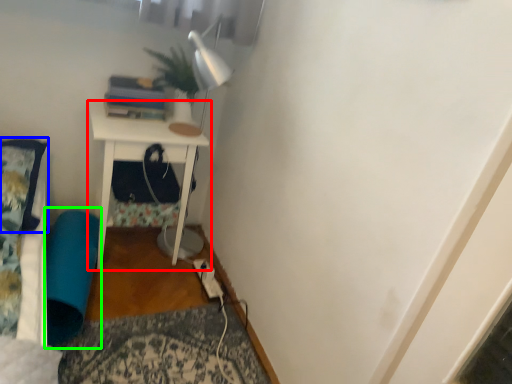
Question: Based on their relative distances, which object is nearer to nightstand (highlighted by a red box)? Choose from pillow (highlighted by a blue box) and bean bag chair (highlighted by a green box).

Choices:
 (A) pillow
 (B) bean bag chair

Answer: (B)